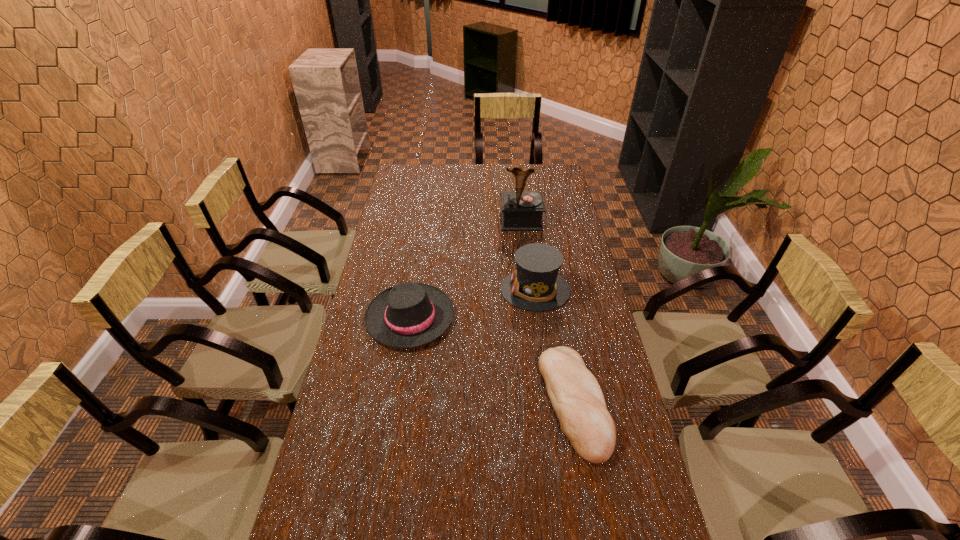
Where is `vacant position in the image that satisfies the following two spatial constraints: 1. at the horn opening of the bread; 2. on the right side of the farthest object`? vacant position in the image that satisfies the following two spatial constraints: 1. at the horn opening of the bread; 2. on the right side of the farthest object is located at coordinates (542, 402).

I want to click on vacant area in the image that satisfies the following two spatial constraints: 1. with goggles on the front of the third shortest object; 2. on the front side of the left dress hat, so click(539, 318).

Identify the location of free location that satisfies the following two spatial constraints: 1. at the horn opening of the phonograph_record; 2. on the left side of the bread. The height and width of the screenshot is (540, 960). (542, 402).

This screenshot has width=960, height=540. What are the coordinates of `vacant space that satisfies the following two spatial constraints: 1. at the horn opening of the farthest object; 2. on the right side of the bread` in the screenshot? It's located at (542, 402).

You are a GUI agent. You are given a task and a screenshot of the screen. Output one action in this format:
    pyautogui.click(x=<x>, y=<y>)
    Task: Click on the blank space that satisfies the following two spatial constraints: 1. on the front side of the bread; 2. on the right side of the leftmost object
    The width and height of the screenshot is (960, 540).
    Given the screenshot: What is the action you would take?
    pyautogui.click(x=396, y=402)

The height and width of the screenshot is (540, 960). Find the location of `free spot that satisfies the following two spatial constraints: 1. with goggles on the front of the taller dress hat; 2. on the left side of the shortest object`. free spot that satisfies the following two spatial constraints: 1. with goggles on the front of the taller dress hat; 2. on the left side of the shortest object is located at coordinates (550, 402).